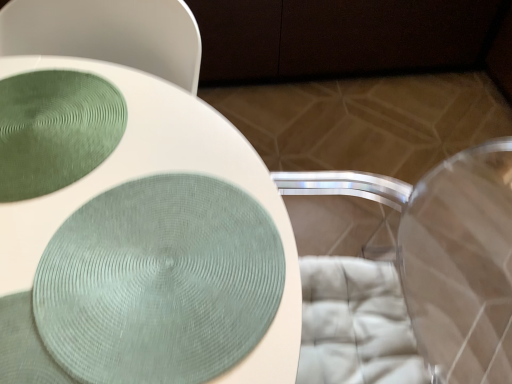
You are a GUI agent. You are given a task and a screenshot of the screen. Output one action in this format:
    pyautogui.click(x=<x>, y=<y>)
    Task: Click on the free space to the right of green textured glass plate at upper left
    The width and height of the screenshot is (512, 384).
    Given the screenshot: What is the action you would take?
    pyautogui.click(x=179, y=169)